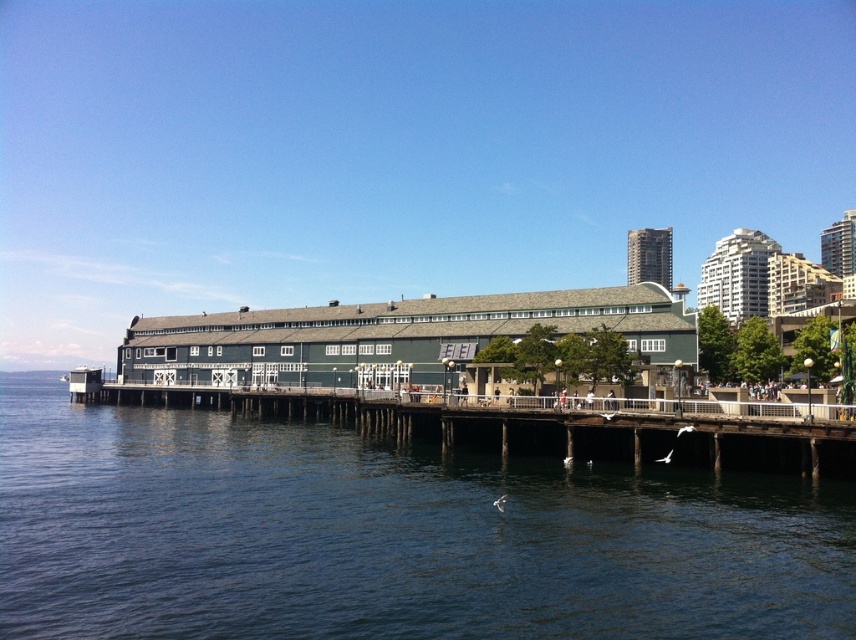
Is dark blue water at lower center to the right of brown wooden dock at center from the viewer's perspective?

Incorrect, dark blue water at lower center is not on the right side of brown wooden dock at center.

Measure the distance between dark blue water at lower center and camera.

dark blue water at lower center is 34.42 meters away from camera.

Locate an element on the screen. This screenshot has width=856, height=640. dark blue water at lower center is located at coordinates (388, 536).